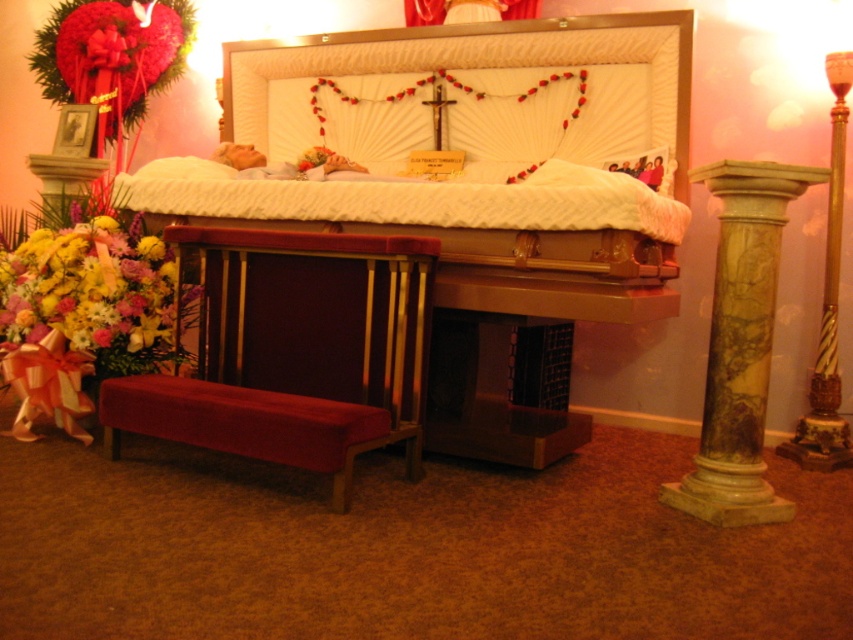
Question: Which object appears farthest from the camera in this image?

Choices:
 (A) green marble column at right
 (B) vibrant floral bouquet at lower left

Answer: (B)

Question: Which point is farther to the camera?

Choices:
 (A) (761, 365)
 (B) (169, 266)
 (C) (654, 86)

Answer: (C)

Question: Does velvet red church bench at lower left come behind vibrant floral bouquet at lower left?

Choices:
 (A) no
 (B) yes

Answer: (A)

Question: Can you confirm if velvet red church bench at lower left is positioned to the left of vibrant floral bouquet at lower left?

Choices:
 (A) no
 (B) yes

Answer: (A)

Question: Can you confirm if white satin bed at center is smaller than green marble column at right?

Choices:
 (A) yes
 (B) no

Answer: (B)

Question: Which of the following is the farthest from the observer?

Choices:
 (A) green marble column at right
 (B) velvet red church bench at lower left
 (C) vibrant floral bouquet at lower left

Answer: (C)